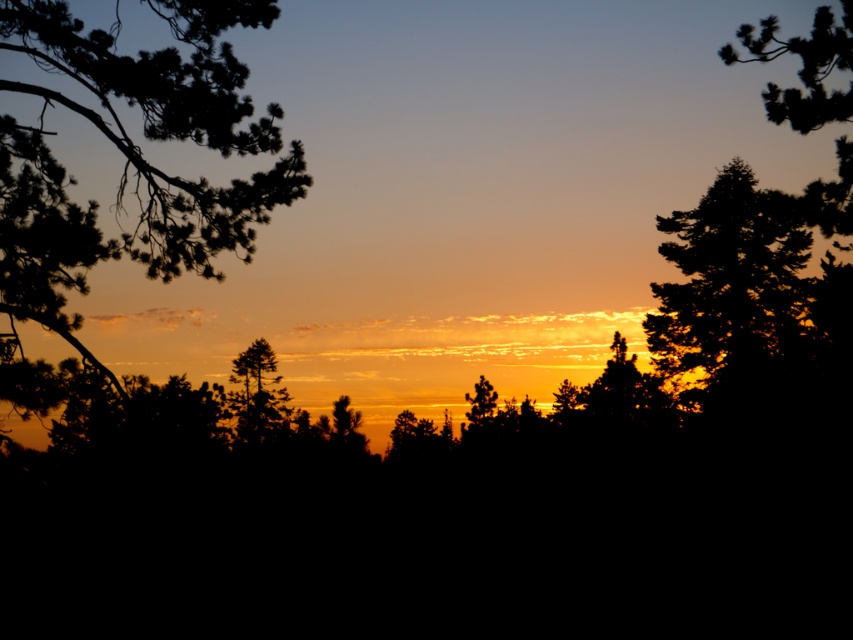
Measure the distance between silhouette branch at left and dark green textured pine tree at upper right.

silhouette branch at left is 16.89 feet from dark green textured pine tree at upper right.

Between point (6, 138) and point (819, 184), which one is positioned behind?

Positioned behind is point (819, 184).

This screenshot has height=640, width=853. Describe the element at coordinates (132, 154) in the screenshot. I see `silhouette branch at left` at that location.

Identify the location of silhouette branch at left. This screenshot has height=640, width=853. (132, 154).

Between silhouette branch at left and silhouette pine tree at center, which one has less height?

silhouette branch at left is shorter.

Describe the element at coordinates (132, 154) in the screenshot. I see `silhouette branch at left` at that location.

Find the location of a particular element. This screenshot has height=640, width=853. silhouette branch at left is located at coordinates (132, 154).

Can you confirm if dark green textured tree at right is smaller than silhouette pine tree at center?

No, dark green textured tree at right is not smaller than silhouette pine tree at center.

Image resolution: width=853 pixels, height=640 pixels. What do you see at coordinates (735, 298) in the screenshot?
I see `dark green textured tree at right` at bounding box center [735, 298].

Where is `dark green textured tree at right`? The image size is (853, 640). dark green textured tree at right is located at coordinates pyautogui.click(x=735, y=298).